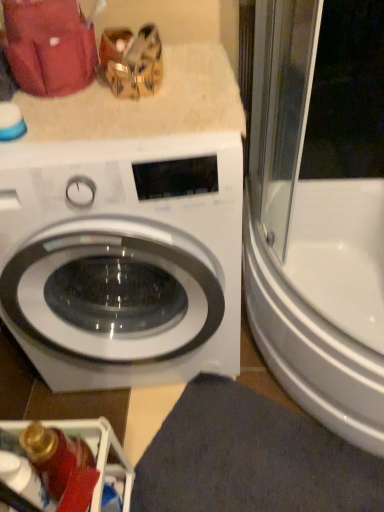
Question: In the image, is white glossy bathtub at right on the left side or the right side of metallic silver dishwasher at lower left?

Choices:
 (A) right
 (B) left

Answer: (A)

Question: Is white glossy bathtub at right taller or shorter than metallic silver dishwasher at lower left?

Choices:
 (A) short
 (B) tall

Answer: (B)

Question: Which of these objects is positioned farthest from the dark gray fabric bath mat at lower center?

Choices:
 (A) white glossy washing machine at center
 (B) white glossy bathtub at right
 (C) metallic silver dishwasher at lower left

Answer: (A)

Question: Which object is positioned farthest from the white glossy bathtub at right?

Choices:
 (A) white glossy washing machine at center
 (B) metallic silver dishwasher at lower left
 (C) dark gray fabric bath mat at lower center

Answer: (B)